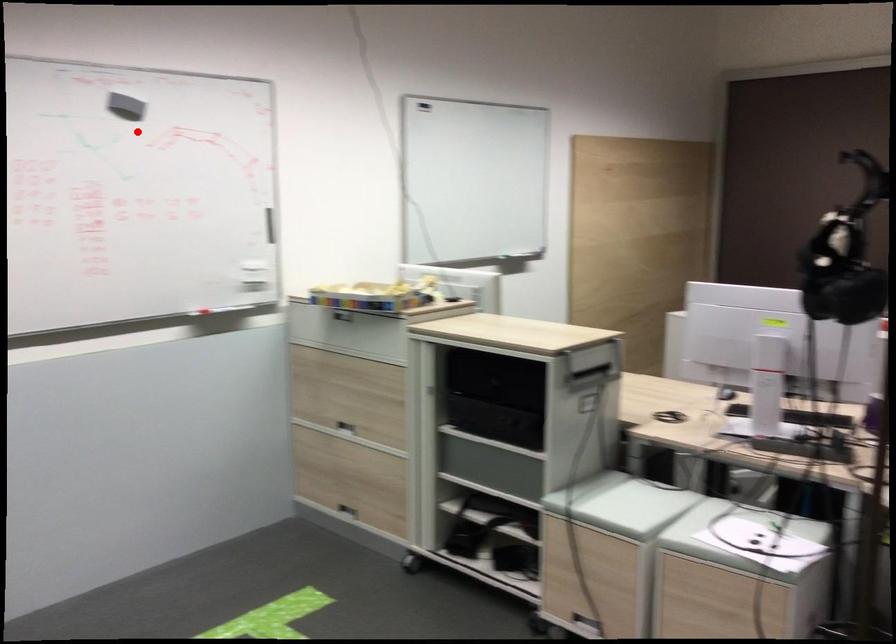
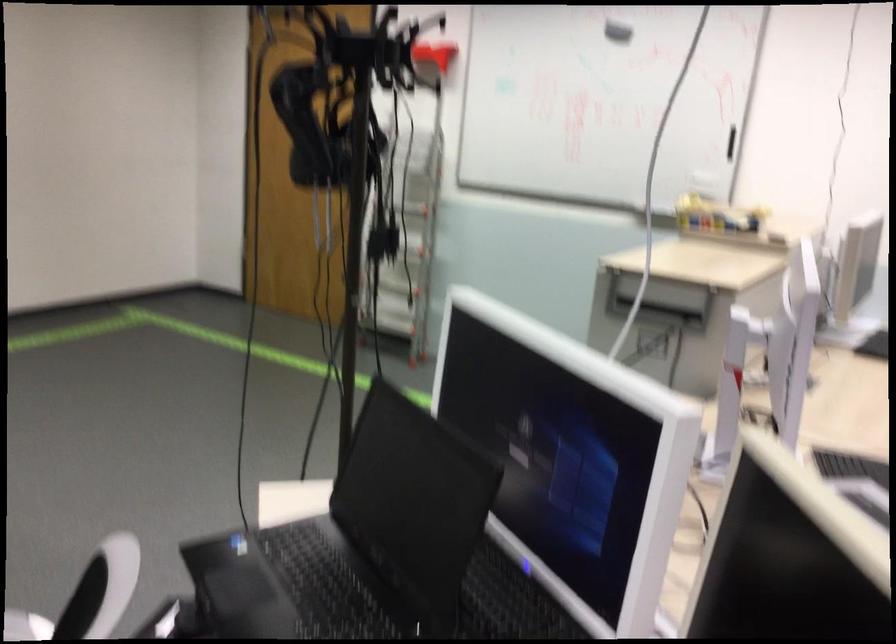
Question: I am providing you with two images of the same scene from different viewpoints. Image1 has a red point marked. In image2, the corresponding 3D location appears at what relative position? Reply with the corresponding letter.

Choices:
 (A) Closer
 (B) Farther

Answer: (B)